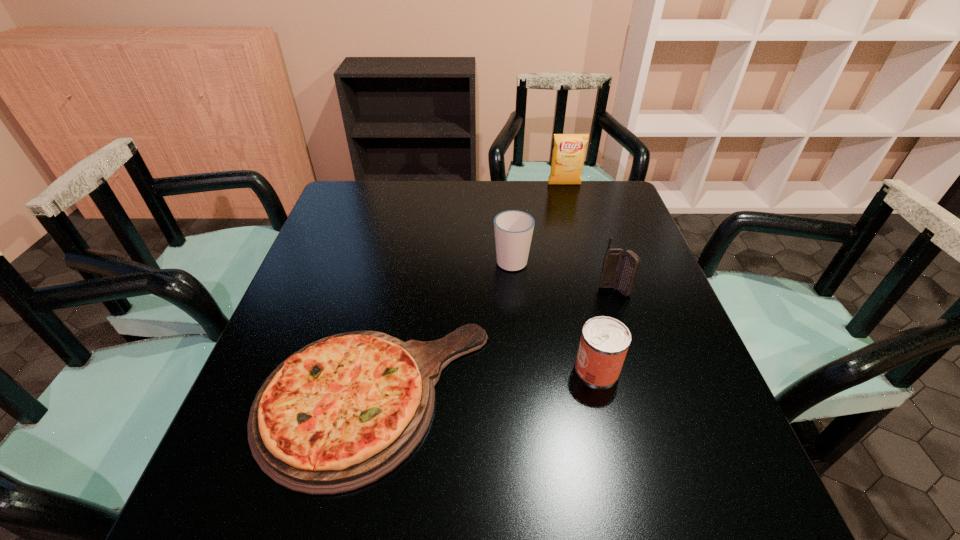
This screenshot has width=960, height=540. I want to click on free location located with a handle on the side of the fourth object from right to left, so click(x=506, y=192).

At what (x,y) coordinates should I click in order to perform the action: click on free space located with a handle on the side of the fourth object from right to left. Please return your answer as a coordinate pair (x, y). This screenshot has width=960, height=540. Looking at the image, I should click on (506, 195).

Find the location of a particular element. The width and height of the screenshot is (960, 540). vacant space located on the right of the fourth tallest object is located at coordinates (661, 369).

Where is `vacant space situated 0.130m on the right of the leftmost object`? This screenshot has width=960, height=540. vacant space situated 0.130m on the right of the leftmost object is located at coordinates (555, 398).

Where is `object positioned at the far edge`? The height and width of the screenshot is (540, 960). object positioned at the far edge is located at coordinates (568, 154).

You are a GUI agent. You are given a task and a screenshot of the screen. Output one action in this format:
    pyautogui.click(x=<x>, y=<y>)
    Task: Click on the object that is at the near edge
    This screenshot has width=960, height=540.
    Given the screenshot: What is the action you would take?
    pyautogui.click(x=341, y=413)

Find the location of a particular element. object situated at the left edge is located at coordinates (341, 413).

The height and width of the screenshot is (540, 960). I want to click on crisp (potato chip) that is at the right edge, so click(x=568, y=154).

Where is `cellular telephone at the right edge`? The image size is (960, 540). cellular telephone at the right edge is located at coordinates pos(619,269).

Locate an element on the screen. The width and height of the screenshot is (960, 540). object located at the near left corner is located at coordinates (341, 413).